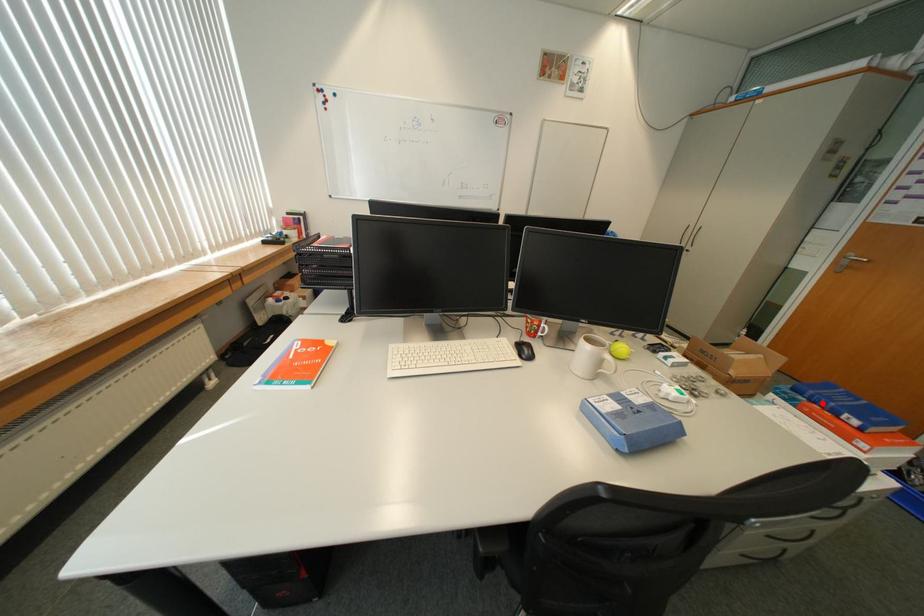
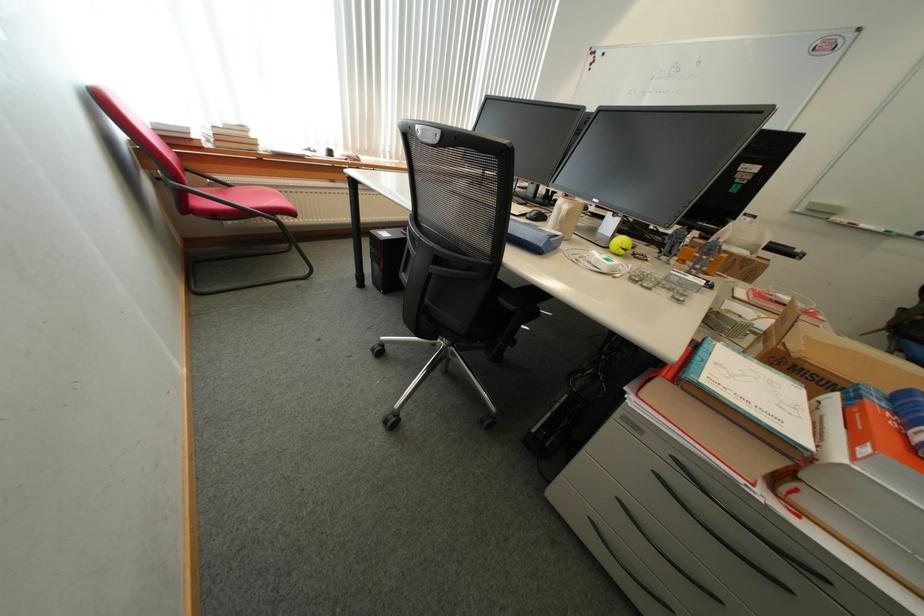
Find the pixel in the second image that matches the highlighted location in the first image.

(906, 415)